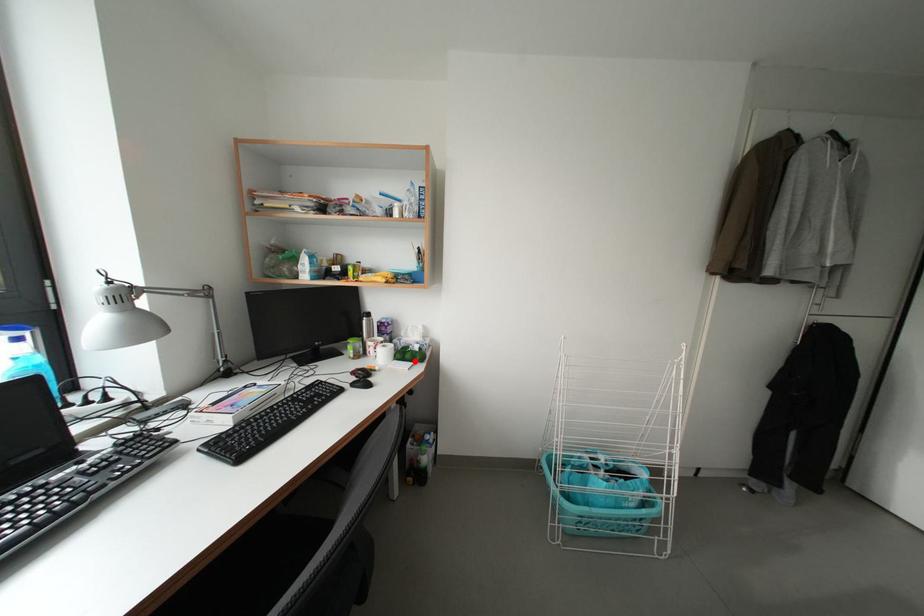
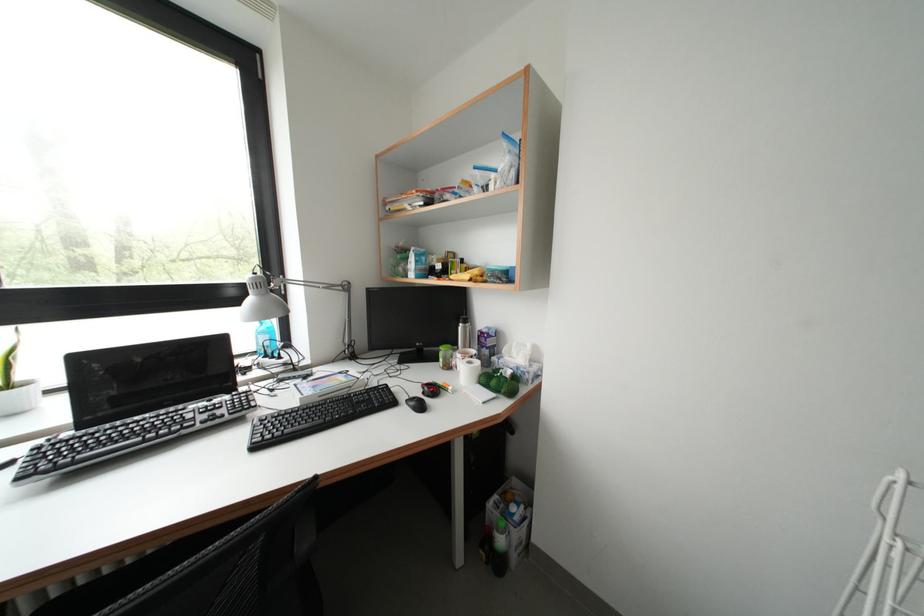
Locate, in the second image, the point that corresponds to the highlighted location in the first image.

(500, 387)